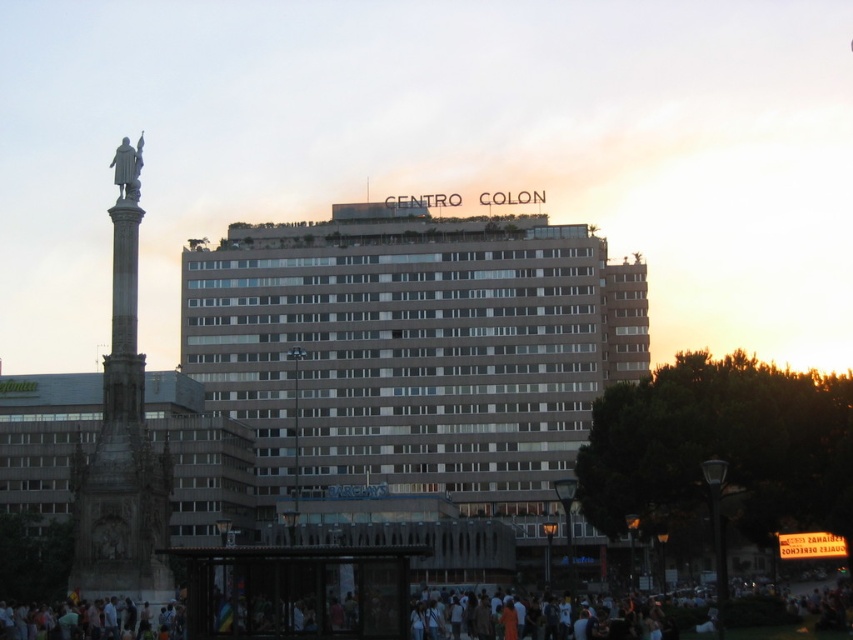
You are standing at the point closest to the building in the scene. Which of the two points, point (398, 456) or point (137, 496), is farther away from you?

Point (398, 456) is farther away from you because it is behind point (137, 496).

You are a tourist standing in the urban area and want to take a photo of the beige concrete building at center and the white cotton crowd at lower center. Based on their positions, which object should you frame first in your camera viewfinder to ensure both are captured in the same shot?

You should frame the beige concrete building at center first since it is to the left of the white cotton crowd at lower center, so positioning the building on the left side of the frame will allow the crowd to be included on the right side.

You are standing at the point closest to the building in the image. Which of the two points, point (691, 595) or point (122, 173), is farther away from you?

Point (691, 595) is farther away because it is behind point (122, 173).